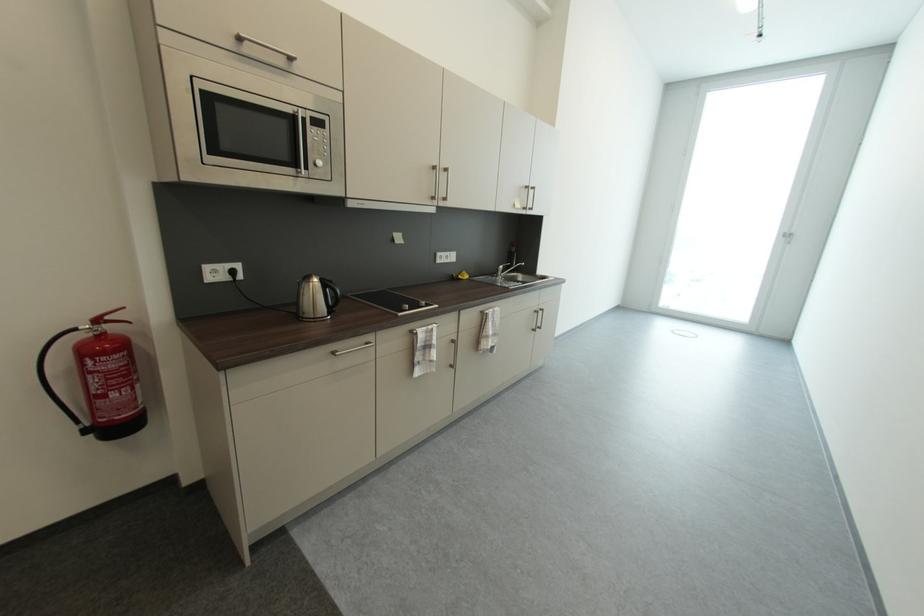
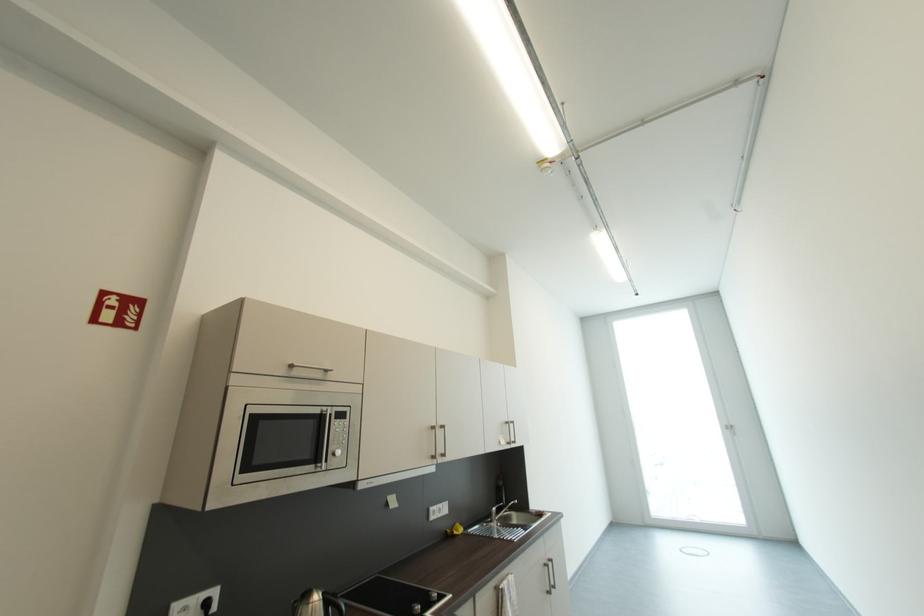
Find the pixel in the second image that matches (317,119) in the first image.

(342, 413)